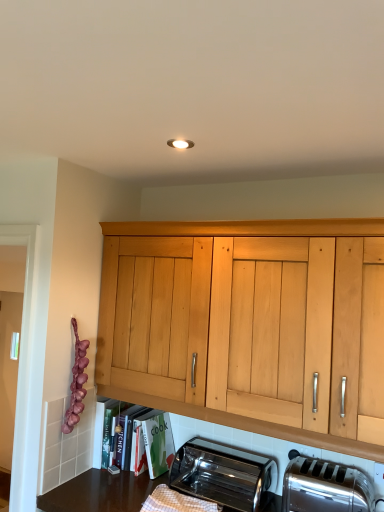
Question: Is satin silver toaster at lower right, the first toaster positioned from the right, directly adjacent to matte wooden shelf at lower center?

Choices:
 (A) yes
 (B) no

Answer: (B)

Question: From the image's perspective, is satin silver toaster at lower right, which appears as the 2th toaster when viewed from the left, below matte wooden shelf at lower center?

Choices:
 (A) yes
 (B) no

Answer: (A)

Question: Considering the relative positions of satin silver toaster at lower right, the first toaster positioned from the right, and matte wooden shelf at lower center in the image provided, is satin silver toaster at lower right, the first toaster positioned from the right, in front of matte wooden shelf at lower center?

Choices:
 (A) yes
 (B) no

Answer: (A)

Question: Are satin silver toaster at lower right, which appears as the 2th toaster when viewed from the left, and matte wooden shelf at lower center located far from each other?

Choices:
 (A) no
 (B) yes

Answer: (A)

Question: Is satin silver toaster at lower right, the first toaster positioned from the right, bigger than matte wooden shelf at lower center?

Choices:
 (A) no
 (B) yes

Answer: (A)

Question: Is the position of satin silver toaster at lower right, which appears as the 2th toaster when viewed from the left, more distant than that of matte wooden shelf at lower center?

Choices:
 (A) no
 (B) yes

Answer: (A)

Question: From a real-world perspective, is polished stainless steel toaster at lower center, positioned as the first toaster in left-to-right order, positioned under satin silver toaster at lower right, the first toaster positioned from the right, based on gravity?

Choices:
 (A) no
 (B) yes

Answer: (B)

Question: From the image's perspective, is polished stainless steel toaster at lower center, the second toaster viewed from the right, located above satin silver toaster at lower right, which appears as the 2th toaster when viewed from the left?

Choices:
 (A) yes
 (B) no

Answer: (B)

Question: Is polished stainless steel toaster at lower center, the second toaster viewed from the right, not close to satin silver toaster at lower right, the first toaster positioned from the right?

Choices:
 (A) no
 (B) yes

Answer: (A)

Question: Is polished stainless steel toaster at lower center, the second toaster viewed from the right, to the left of satin silver toaster at lower right, the first toaster positioned from the right, from the viewer's perspective?

Choices:
 (A) yes
 (B) no

Answer: (A)

Question: Is polished stainless steel toaster at lower center, positioned as the first toaster in left-to-right order, further to the viewer compared to satin silver toaster at lower right, the first toaster positioned from the right?

Choices:
 (A) yes
 (B) no

Answer: (A)

Question: Is polished stainless steel toaster at lower center, positioned as the first toaster in left-to-right order, at the right side of satin silver toaster at lower right, which appears as the 2th toaster when viewed from the left?

Choices:
 (A) yes
 (B) no

Answer: (B)

Question: Can you confirm if matte wooden shelf at lower center is positioned to the left of polished stainless steel toaster at lower center, positioned as the first toaster in left-to-right order?

Choices:
 (A) no
 (B) yes

Answer: (B)